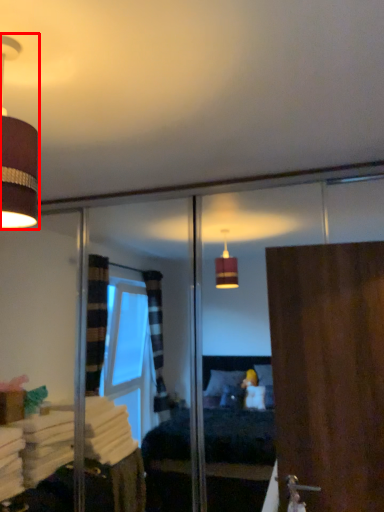
Question: From the image's perspective, considering the relative positions of lamp (annotated by the red box) and door in the image provided, where is lamp (annotated by the red box) located with respect to the staircase?

Choices:
 (A) above
 (B) below

Answer: (A)